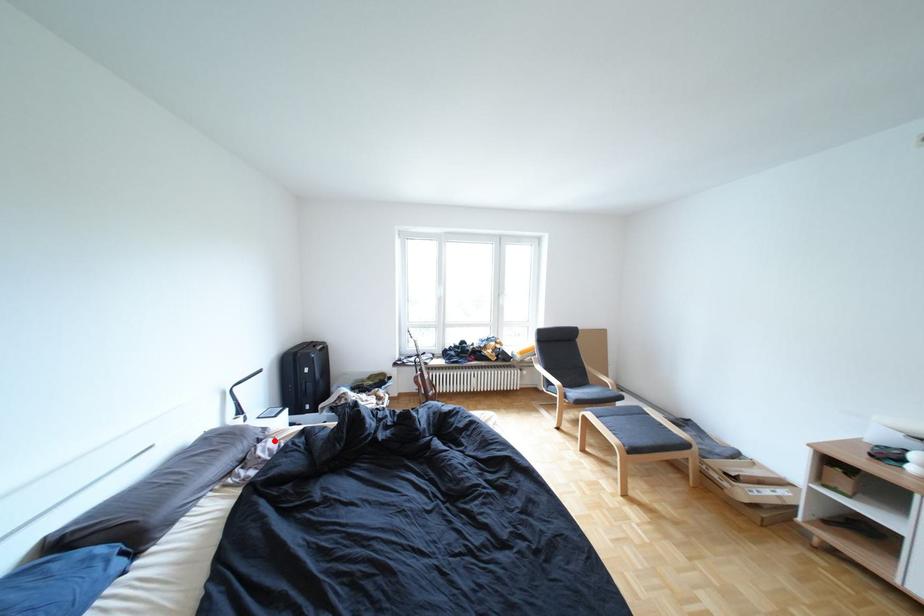
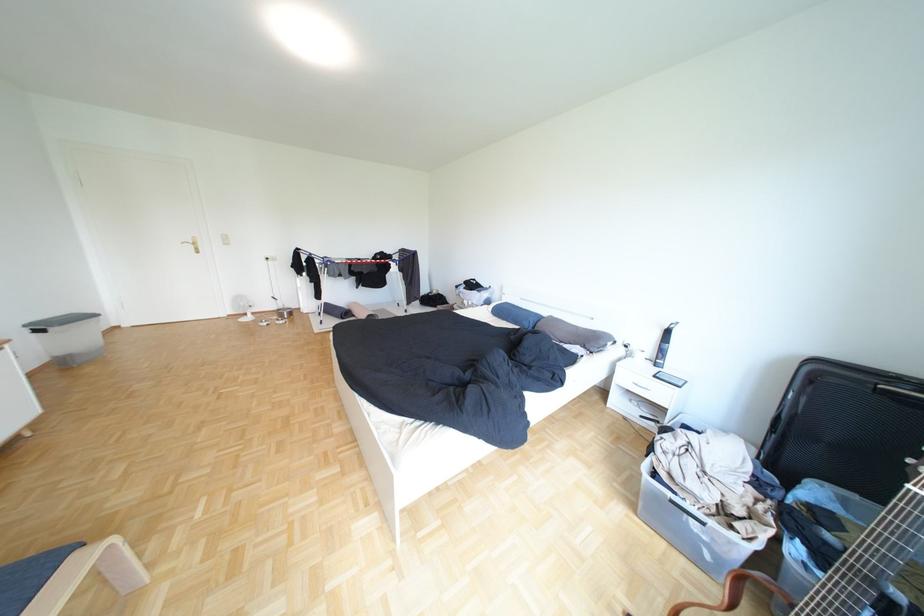
Find the pixel in the second image that matches the highlighted location in the first image.

(600, 347)